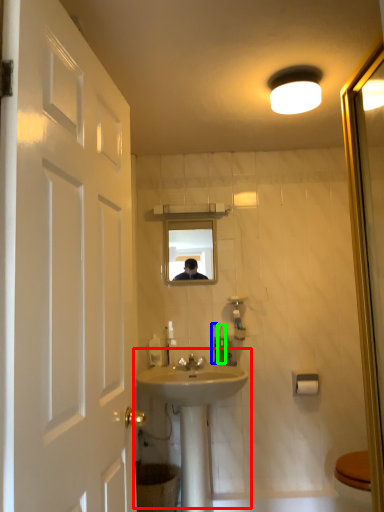
Question: Based on their relative distances, which object is farther from sink (highlighted by a red box)? Choose from toothbrush (highlighted by a blue box) and toiletry (highlighted by a green box).

Choices:
 (A) toothbrush
 (B) toiletry

Answer: (A)